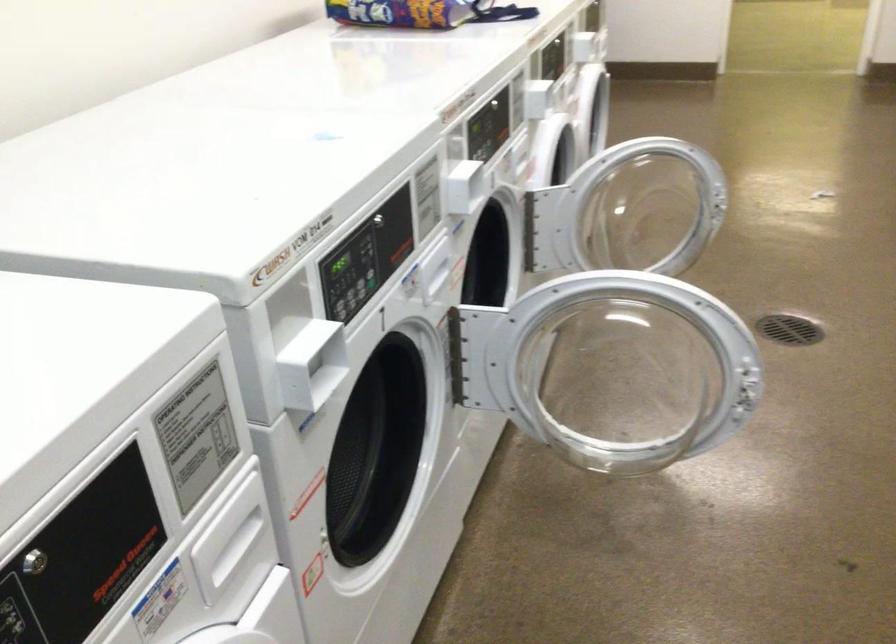
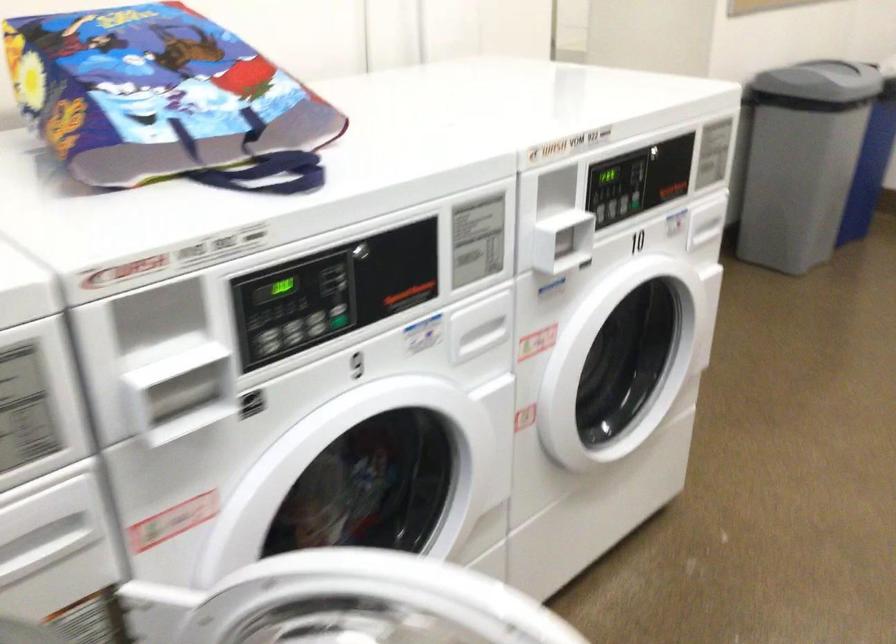
The images are taken continuously from a first-person perspective. In which direction are you moving?

The cameraman walked toward right, forward.